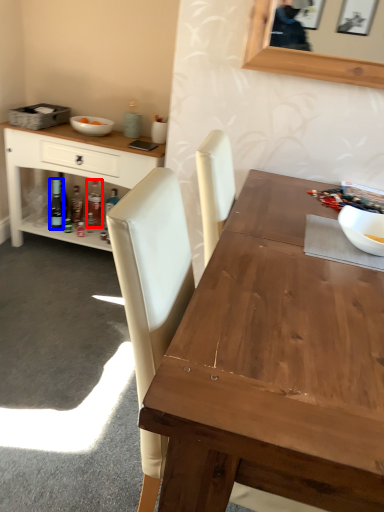
Question: Which object appears farthest to the camera in this image, bottle (highlighted by a red box) or bottle (highlighted by a blue box)?

Choices:
 (A) bottle
 (B) bottle

Answer: (A)